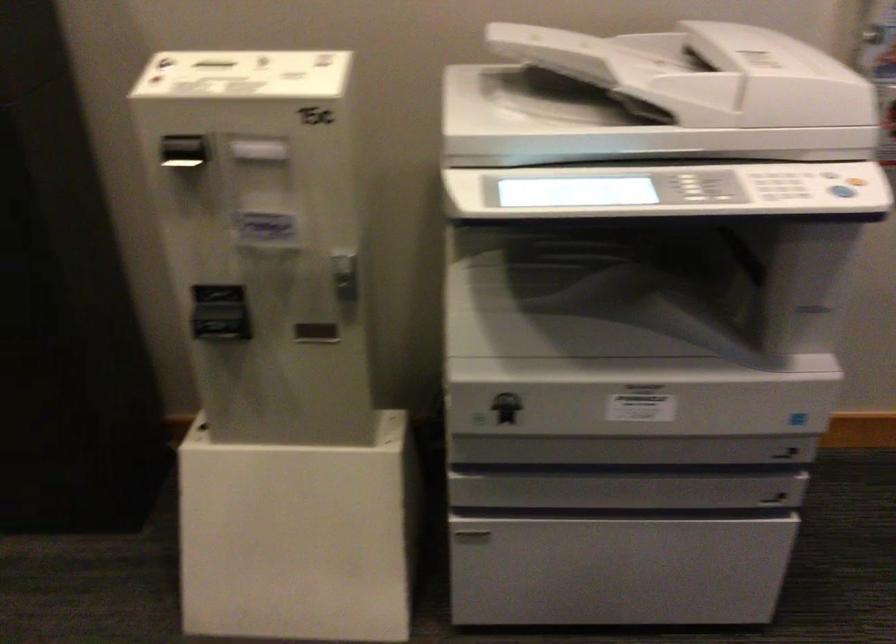
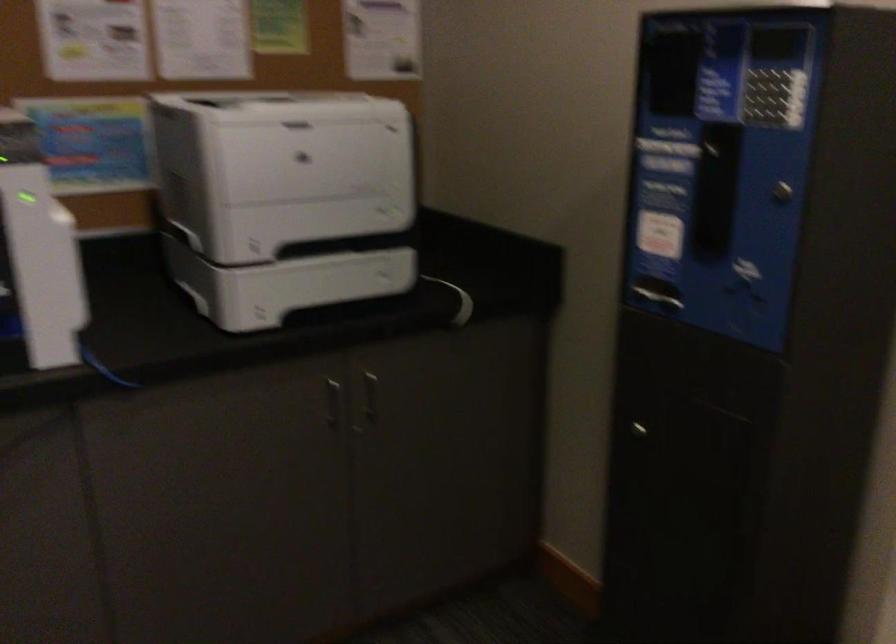
Question: The camera is either moving clockwise (left) or counter-clockwise (right) around the object. The first image is from the beginning of the video and the second image is from the end. Is the camera moving left or right when shooting the video?

Choices:
 (A) Left
 (B) Right

Answer: (B)